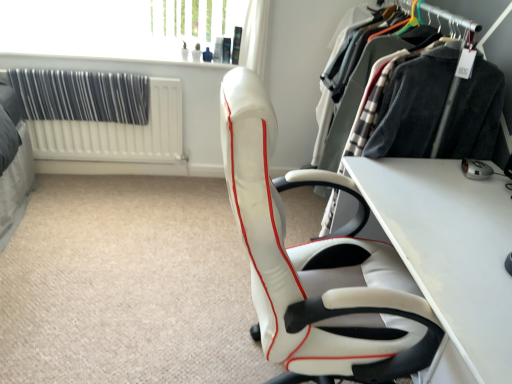
Question: Should I look upward or downward to see white textured radiator at left?

Choices:
 (A) down
 (B) up

Answer: (B)

Question: From the image's perspective, would you say white leather chair at center is shown under white glossy table at center?

Choices:
 (A) yes
 (B) no

Answer: (B)

Question: Is white leather chair at center turned away from white glossy table at center?

Choices:
 (A) yes
 (B) no

Answer: (B)

Question: From a real-world perspective, is white leather chair at center located beneath white glossy table at center?

Choices:
 (A) yes
 (B) no

Answer: (B)

Question: Does white leather chair at center have a smaller size compared to white glossy table at center?

Choices:
 (A) no
 (B) yes

Answer: (A)

Question: Is white leather chair at center located outside white glossy table at center?

Choices:
 (A) yes
 (B) no

Answer: (A)

Question: Is white leather chair at center next to white glossy table at center?

Choices:
 (A) yes
 (B) no

Answer: (B)

Question: Does transparent glass window screen at upper center have a lesser height compared to white glossy table at center?

Choices:
 (A) no
 (B) yes

Answer: (B)

Question: Can you see transparent glass window screen at upper center touching white glossy table at center?

Choices:
 (A) yes
 (B) no

Answer: (B)

Question: Does transparent glass window screen at upper center come behind white glossy table at center?

Choices:
 (A) no
 (B) yes

Answer: (B)

Question: Does transparent glass window screen at upper center have a larger size compared to white glossy table at center?

Choices:
 (A) no
 (B) yes

Answer: (A)

Question: Does transparent glass window screen at upper center have a lesser width compared to white glossy table at center?

Choices:
 (A) yes
 (B) no

Answer: (A)

Question: From a real-world perspective, is transparent glass window screen at upper center on white glossy table at center?

Choices:
 (A) no
 (B) yes

Answer: (B)

Question: Is white leather chair at center not close to white textured radiator at left?

Choices:
 (A) yes
 (B) no

Answer: (A)